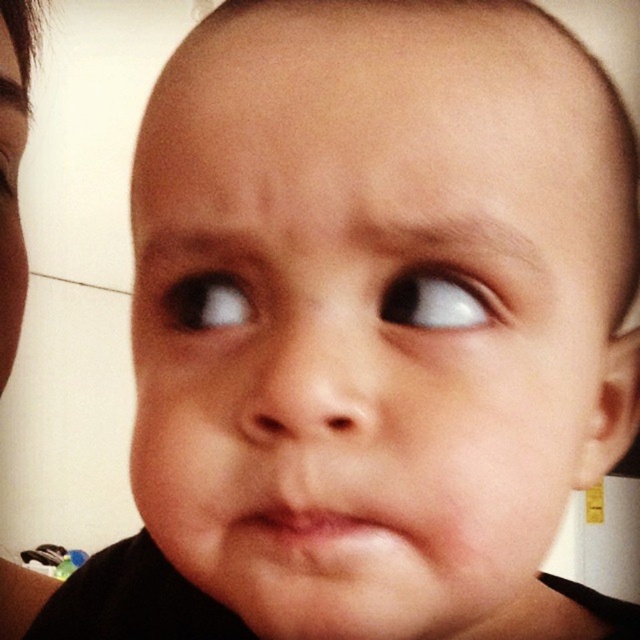
Who is higher up, pink matte lips at center or brown glossy eye at upper center?

brown glossy eye at upper center

Does point (336, 538) come closer to viewer compared to point (170, 288)?

Yes, it is.

The image size is (640, 640). Identify the location of pink matte lips at center. (316, 525).

Is the position of brown hair at upper left more distant than that of pink matte lips at center?

Yes, it is behind pink matte lips at center.

Is brown hair at upper left bigger than pink matte lips at center?

Correct, brown hair at upper left is larger in size than pink matte lips at center.

Is point (19, 45) farther from viewer compared to point (276, 525)?

That is True.

Image resolution: width=640 pixels, height=640 pixels. I want to click on brown hair at upper left, so click(x=12, y=179).

Is brown hair at upper left to the left of white glossy eye at upper right from the viewer's perspective?

Correct, you'll find brown hair at upper left to the left of white glossy eye at upper right.

Which is in front, point (0, 326) or point (380, 308)?

Point (380, 308)

Does point (13, 234) come farther from viewer compared to point (422, 328)?

That is True.

Locate an element on the screen. brown hair at upper left is located at coordinates (12, 179).